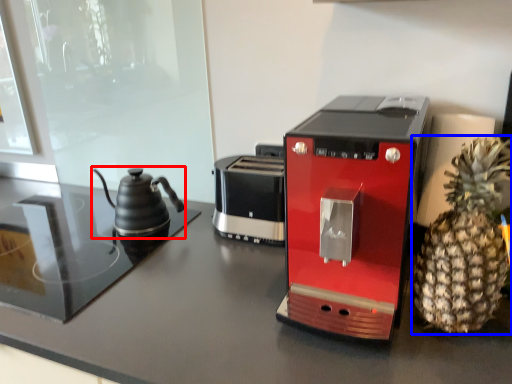
Question: Which object is closer to the camera taking this photo, kettle (highlighted by a red box) or pineapple (highlighted by a blue box)?

Choices:
 (A) kettle
 (B) pineapple

Answer: (B)